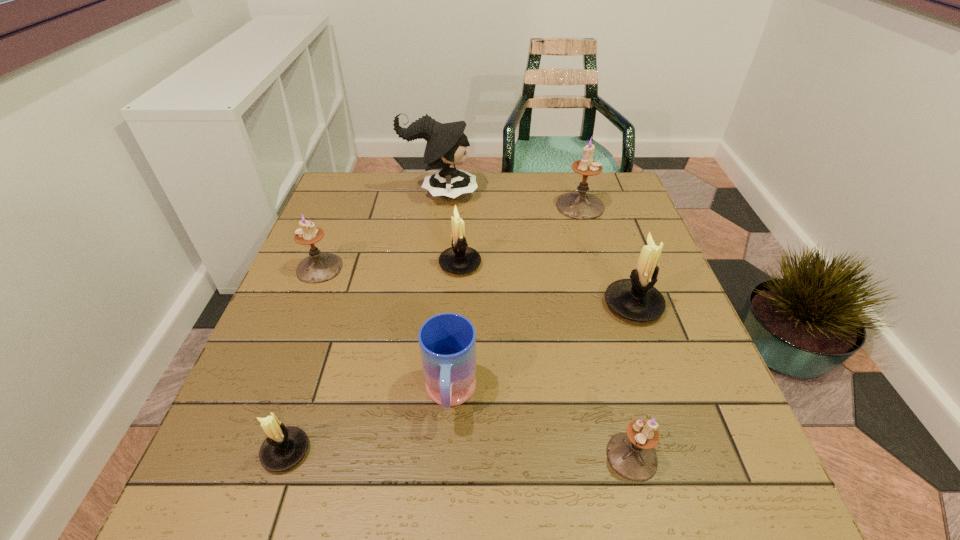
Find the location of a particular element. doll positioned at the far edge is located at coordinates (446, 145).

Image resolution: width=960 pixels, height=540 pixels. Identify the location of candle holder that is at the far edge. (580, 205).

I want to click on object positioned at the near left corner, so click(x=284, y=447).

Identify the location of object that is at the far right corner. Image resolution: width=960 pixels, height=540 pixels. (580, 205).

Find the location of a particular element. The width and height of the screenshot is (960, 540). object present at the near right corner is located at coordinates (631, 454).

I want to click on free spot at the far edge of the desktop, so click(x=521, y=190).

Image resolution: width=960 pixels, height=540 pixels. I want to click on vacant space at the near edge of the desktop, so click(441, 497).

Where is `vacant space at the left edge`? vacant space at the left edge is located at coordinates (274, 403).

Where is `free location at the right edge of the desktop`? The height and width of the screenshot is (540, 960). free location at the right edge of the desktop is located at coordinates (703, 411).

In the image, there is a desktop. Find the location of `vacant space at the far left corner`. vacant space at the far left corner is located at coordinates (357, 192).